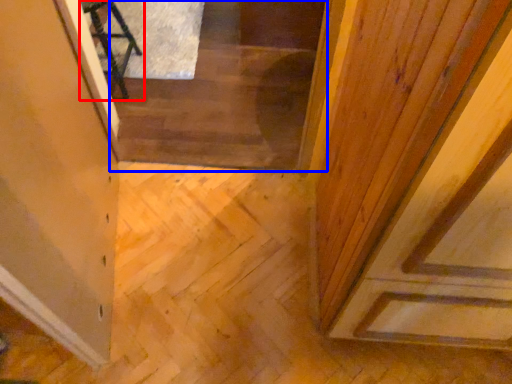
Question: Which point is further to the camera, furniture (highlighted by a red box) or stairwell (highlighted by a blue box)?

Choices:
 (A) furniture
 (B) stairwell

Answer: (B)